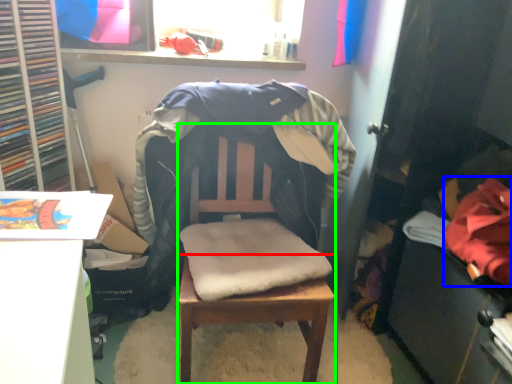
Question: Which object is the closest to the table (highlighted by a red box)? Choose among these: clothing (highlighted by a blue box) or chair (highlighted by a green box).

Choices:
 (A) clothing
 (B) chair

Answer: (B)